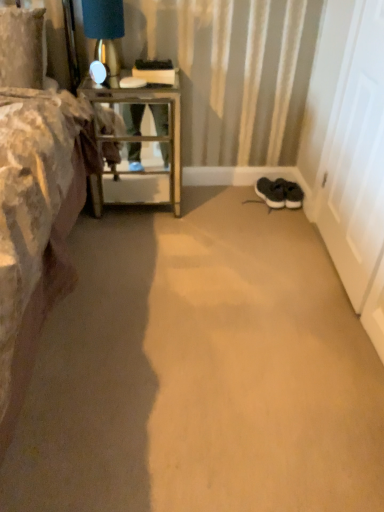
Question: Is matte gold table lamp at upper left taller or shorter than metallic glass table at left?

Choices:
 (A) short
 (B) tall

Answer: (A)

Question: Is point (114, 0) closer or farther from the camera than point (122, 174)?

Choices:
 (A) closer
 (B) farther

Answer: (A)

Question: Estimate the real-world distances between objects in this image. Which object is closer to the white matte door at right?

Choices:
 (A) metallic glass table at left
 (B) black suede sneakers at lower right
 (C) matte gold table lamp at upper left

Answer: (B)

Question: Which is farther from the white matte door at right?

Choices:
 (A) metallic glass table at left
 (B) black suede sneakers at lower right
 (C) matte gold table lamp at upper left

Answer: (C)